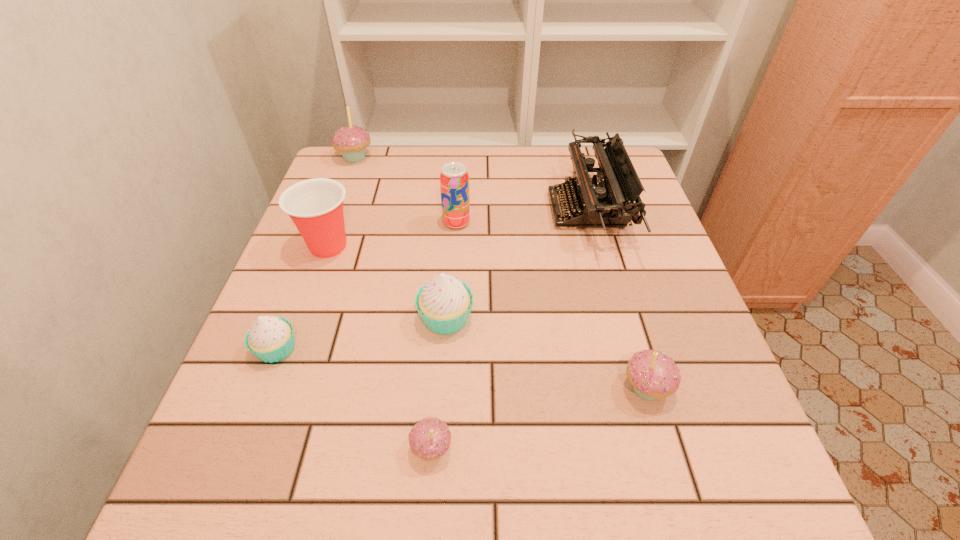
Identify the location of the second pink cupcake from right to left. (430, 438).

Locate an element on the screen. Image resolution: width=960 pixels, height=540 pixels. vacant space located 0.230m on the front of the tallest cupcake is located at coordinates (332, 219).

This screenshot has width=960, height=540. Identify the location of vacant space located 0.380m on the front of the soda can. (448, 371).

This screenshot has height=540, width=960. I want to click on vacant space located on the typing side of the typewriter, so click(x=454, y=210).

You are a GUI agent. You are given a task and a screenshot of the screen. Output one action in this format:
    pyautogui.click(x=<x>, y=<y>)
    Task: Click on the free space located 0.370m on the typing side of the typewriter
    Image resolution: width=960 pixels, height=540 pixels.
    Given the screenshot: What is the action you would take?
    pyautogui.click(x=401, y=210)

Locate an element on the screen. free space located 0.220m on the typing side of the typewriter is located at coordinates (462, 210).

You are a GUI agent. You are given a task and a screenshot of the screen. Output one action in this format:
    pyautogui.click(x=<x>, y=<y>)
    Task: Click on the vacant space located on the right of the cup
    The width and height of the screenshot is (960, 540).
    Given the screenshot: What is the action you would take?
    pyautogui.click(x=494, y=246)

Image resolution: width=960 pixels, height=540 pixels. Identify the location of free space located 0.200m on the right of the bigger white cupcake. (577, 318).

This screenshot has height=540, width=960. I want to click on free location located 0.210m on the left of the rightmost pink cupcake, so click(x=498, y=387).

Where is `free space located on the right of the smaller white cupcake`? free space located on the right of the smaller white cupcake is located at coordinates click(x=343, y=348).